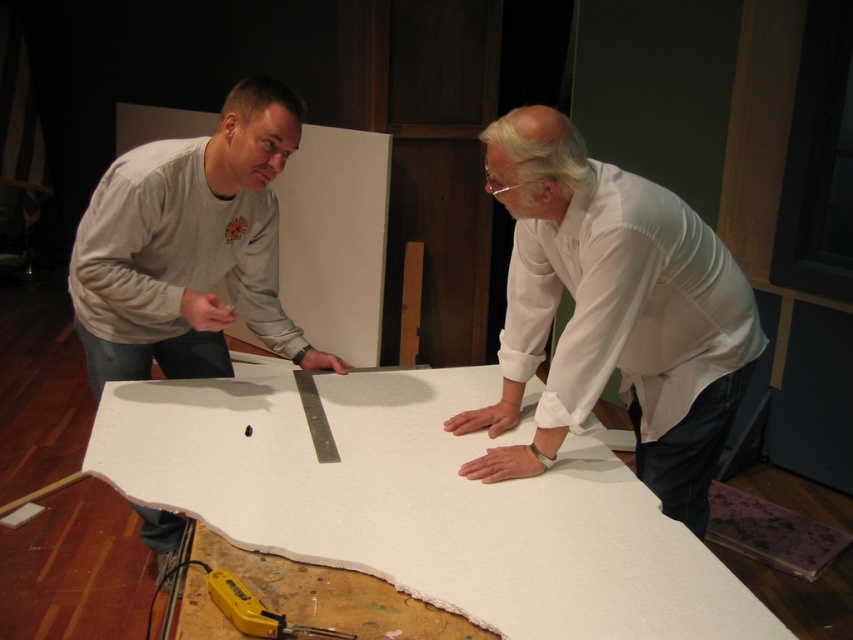
You are an observer standing in front of the scene. You see the white fabric at center and the yellow plastic tool at lower center. Which object is covering the other?

The white fabric at center is positioned over the yellow plastic tool at lower center, so it is covering the tool.

You are a photographer positioned at the entrance of the studio. You want to capture a photo of the white fabric at center and the white matte shirt at upper center in the same frame. Can you ensure both are in focus without adjusting your camera settings?

The white fabric at center and white matte shirt at upper center are 14.21 inches apart. Since the distance between them is relatively small, you can keep both in focus by using a smaller aperture setting on your camera, which increases the depth of field, allowing both objects to remain sharp in the photo.

Please look at the image. There is a point at coordinates (422, 502). Based on the scene description, can you tell me what this point is located on?

The point at coordinates (422, 502) is located on the white fabric at center.